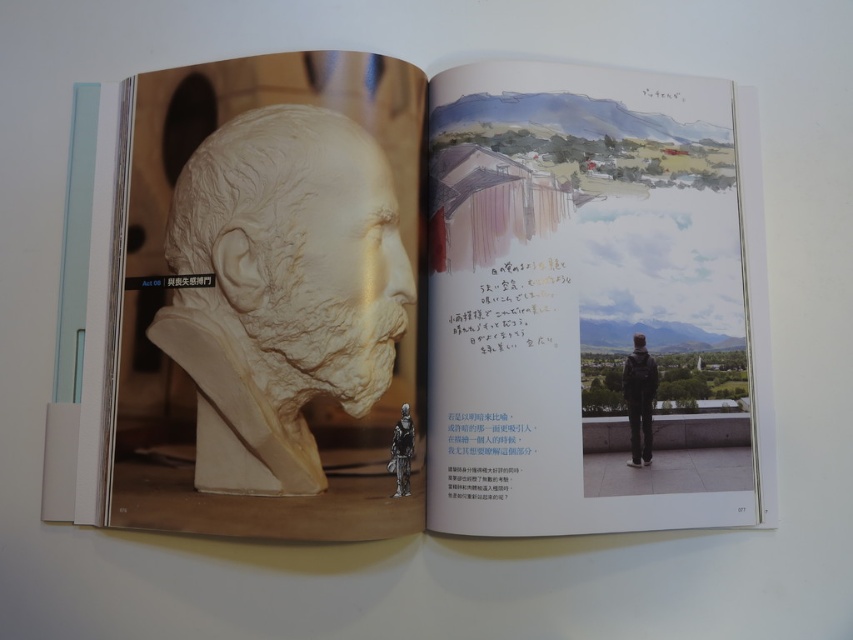
Question: Is white clay bust at left positioned in front of dark gray backpack at center?

Choices:
 (A) yes
 (B) no

Answer: (A)

Question: Among these points, which one is farthest from the camera?

Choices:
 (A) (306, 176)
 (B) (218, 504)
 (C) (410, 456)

Answer: (A)

Question: Estimate the real-world distances between objects in this image. Which object is farther from the white clay bust at center-left?

Choices:
 (A) dark gray backpack at center
 (B) white clay bust at left
 (C) metallic silver armor at center

Answer: (A)

Question: Is white clay bust at center-left to the left of metallic silver armor at center from the viewer's perspective?

Choices:
 (A) no
 (B) yes

Answer: (B)

Question: Among these objects, which one is farthest from the camera?

Choices:
 (A) white clay bust at center-left
 (B) metallic silver armor at center

Answer: (B)

Question: Is white clay bust at left above metallic silver armor at center?

Choices:
 (A) yes
 (B) no

Answer: (A)